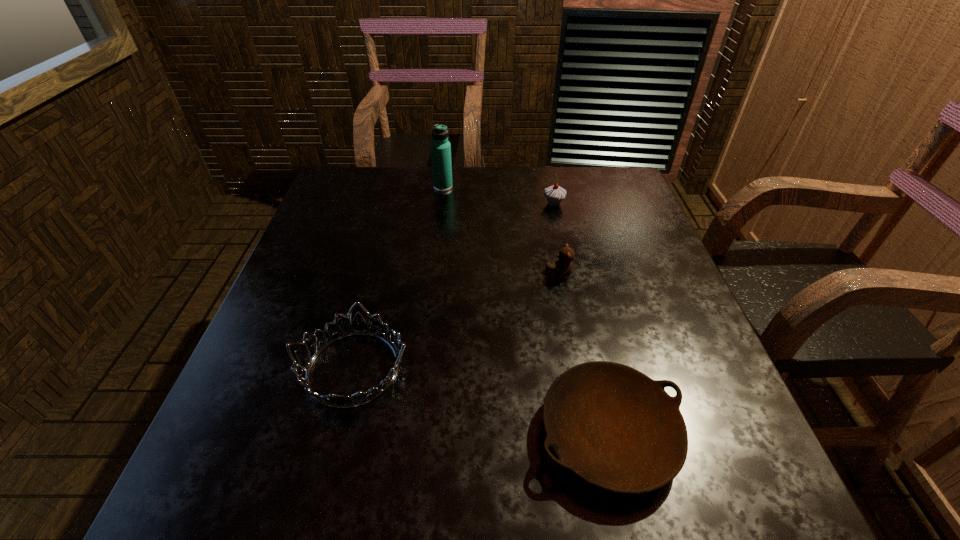
Locate an element on the screen. The width and height of the screenshot is (960, 540). vacant space that satisfies the following two spatial constraints: 1. on the face of the shortest object; 2. on the right side of the third farthest object is located at coordinates (589, 434).